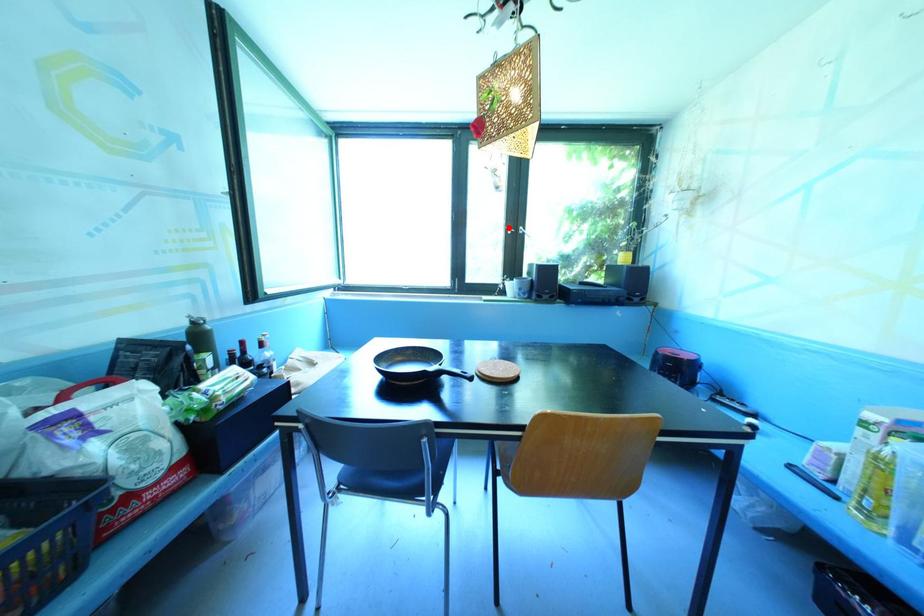
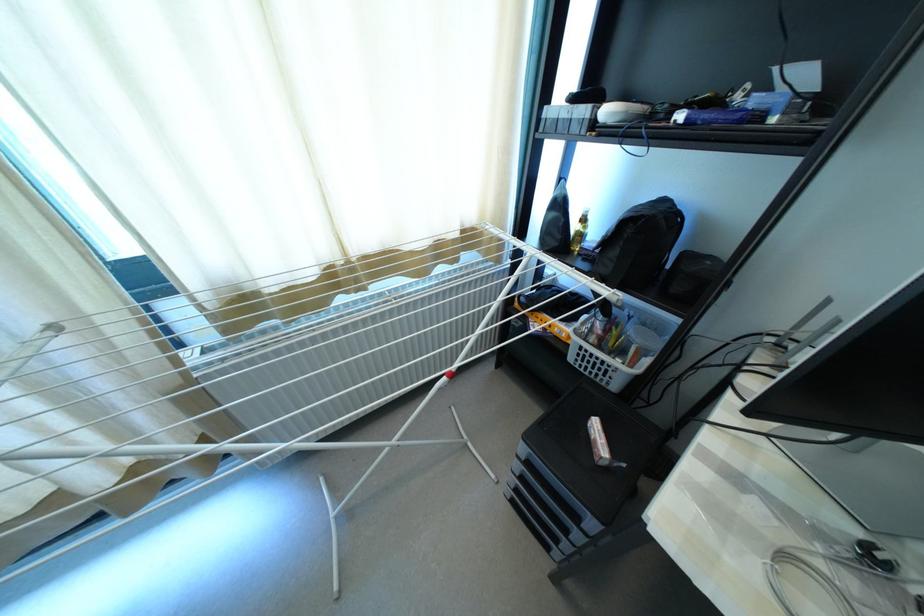
Question: I am providing you with two images of the same scene from different viewpoints. A red point is marked on the first image. Is the red point's position out of view in image 2?

Choices:
 (A) Yes
 (B) No

Answer: (A)